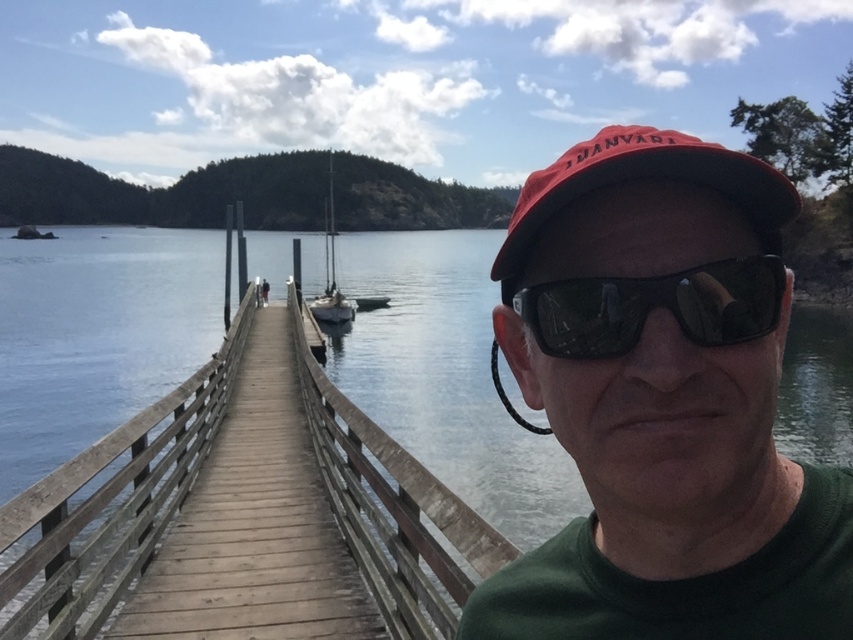
Question: Which point appears closest to the camera in this image?

Choices:
 (A) (105, 595)
 (B) (718, 369)
 (C) (343, 310)

Answer: (B)

Question: Estimate the real-world distances between objects in this image. Which object is farther from the white glossy sailboat at center?

Choices:
 (A) wooden at center
 (B) matte red cap at center

Answer: (B)

Question: Is matte red cap at center below red matte baseball cap at center?

Choices:
 (A) no
 (B) yes

Answer: (B)

Question: Does wooden at center come in front of black reflective sunglasses at center?

Choices:
 (A) yes
 (B) no

Answer: (B)

Question: Among these points, which one is nearest to the camera?

Choices:
 (A) (26, 625)
 (B) (621, 140)

Answer: (B)

Question: Can you confirm if wooden at center is bigger than white glossy sailboat at center?

Choices:
 (A) no
 (B) yes

Answer: (A)